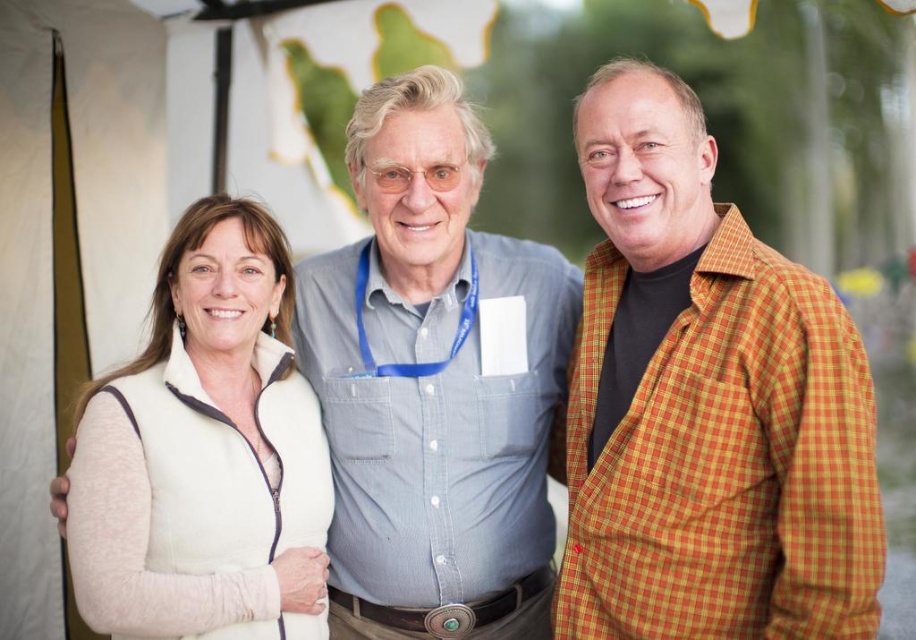
Is orange checkered jacket at right taller than white fleece vest at left?

Yes.

Between orange checkered jacket at right and white fleece vest at left, which one has more height?

With more height is orange checkered jacket at right.

Where is `orange checkered jacket at right`? Image resolution: width=916 pixels, height=640 pixels. orange checkered jacket at right is located at coordinates pos(706,404).

Find the location of a particular element. This screenshot has height=640, width=916. orange checkered jacket at right is located at coordinates (706, 404).

Which is more to the left, light blue button-down shirt at center or white fleece vest at left?

white fleece vest at left

What are the coordinates of `light blue button-down shirt at center` in the screenshot? It's located at (435, 381).

The image size is (916, 640). In order to click on light blue button-down shirt at center in this screenshot , I will do `click(435, 381)`.

Is orange checkered jacket at right wider than light blue button-down shirt at center?

Incorrect, orange checkered jacket at right's width does not surpass light blue button-down shirt at center's.

Can you confirm if orange checkered jacket at right is shorter than light blue button-down shirt at center?

Yes.

Identify the location of orange checkered jacket at right. The image size is (916, 640). (706, 404).

Identify the location of orange checkered jacket at right. The width and height of the screenshot is (916, 640). (706, 404).